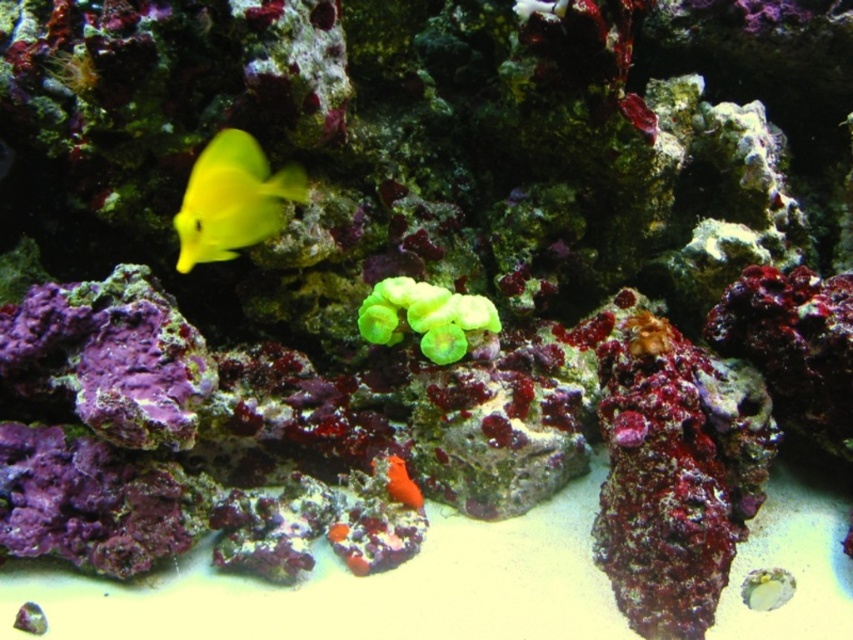
You are a marine biologist using a remotely operated vehicle that has a 10 inch arm. You need to collect a sample from the green matte coral at center while avoiding the yellow matte fish at upper left. Can your vehicle reach the coral without getting too close to the fish?

The yellow matte fish at upper left and green matte coral at center are 11.41 inches apart from each other. Since the ROV arm is 10 inches, the vehicle can reach the green matte coral at center while maintaining a safe distance of 1.41 inches from the yellow matte fish at upper left.

In the scene shown: You are a marine biologist observing this underwater scene. You notice the green matte coral at center and the orange matte sponge at lower center. Which of these two objects is larger in size?

The green matte coral at center is bigger than the orange matte sponge at lower center.